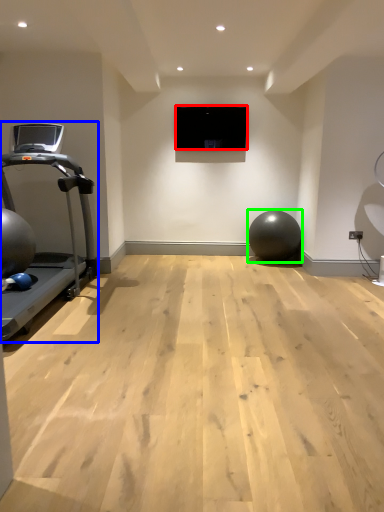
Question: Estimate the real-world distances between objects in this image. Which object is closer to projection screen (highlighted by a red box), treadmill (highlighted by a blue box) or ball (highlighted by a green box)?

Choices:
 (A) treadmill
 (B) ball

Answer: (B)